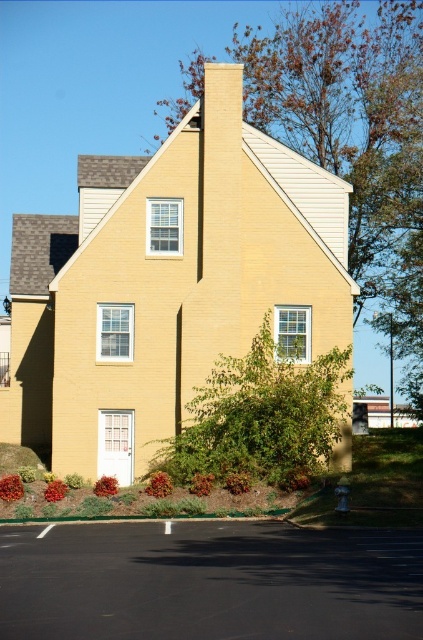
Is green leafy tree at center thinner than green leafy bush at center?

No.

Is green leafy tree at center bigger than green leafy bush at center?

Indeed, green leafy tree at center has a larger size compared to green leafy bush at center.

At what (x,y) coordinates should I click in order to perform the action: click on green leafy tree at center. Please return your answer as a coordinate pair (x, y). The width and height of the screenshot is (423, 640). Looking at the image, I should click on (354, 140).